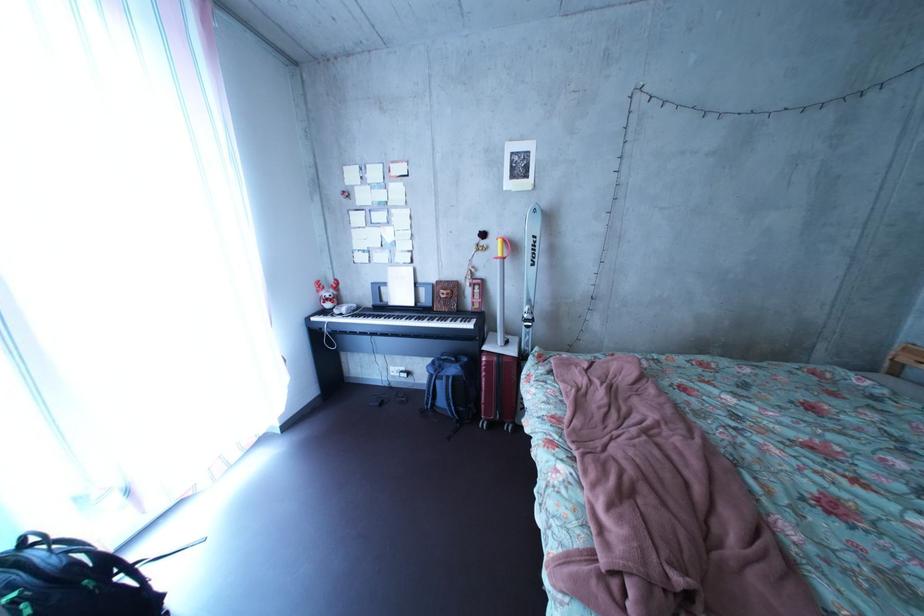
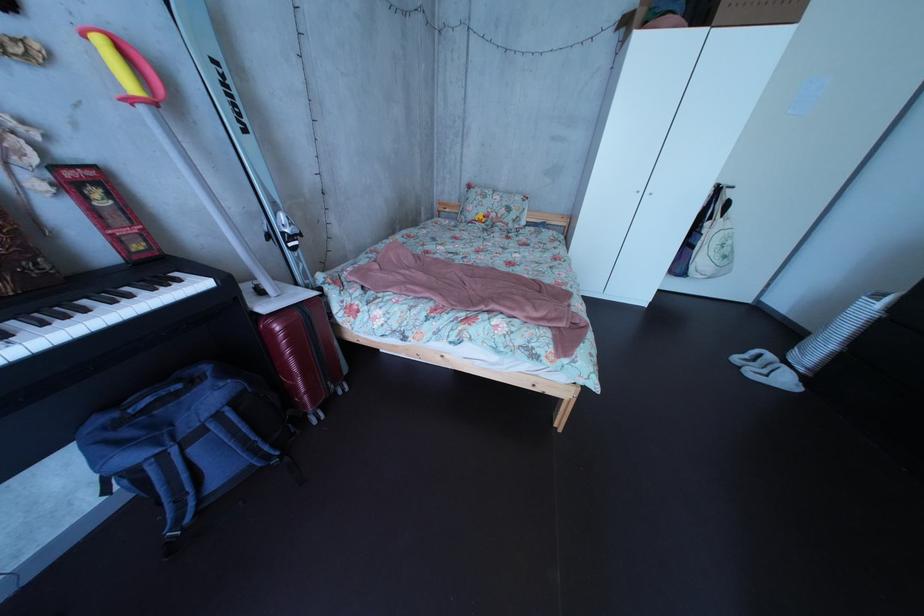
Locate, in the second image, the point that corresponds to the point at 468,329 in the first image.

(128, 305)